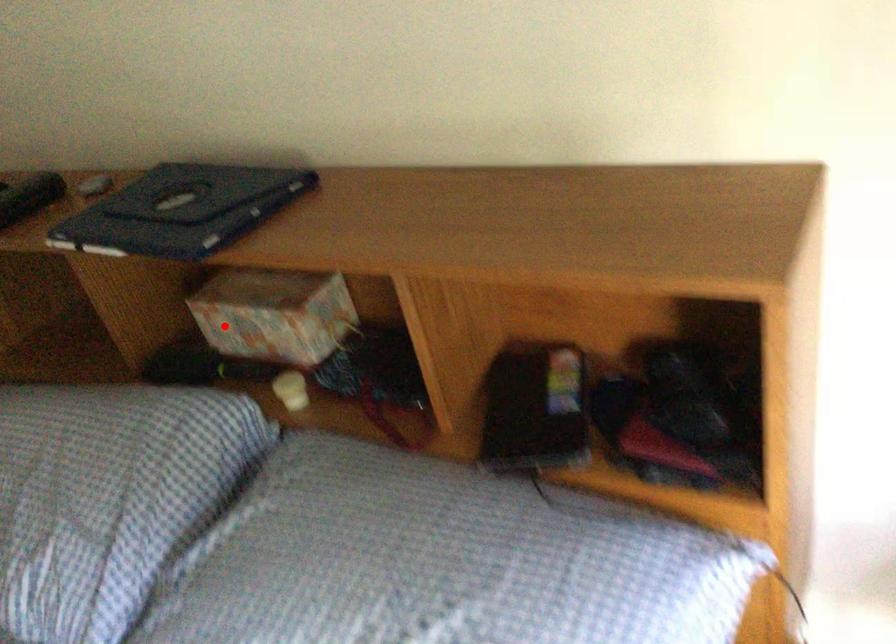
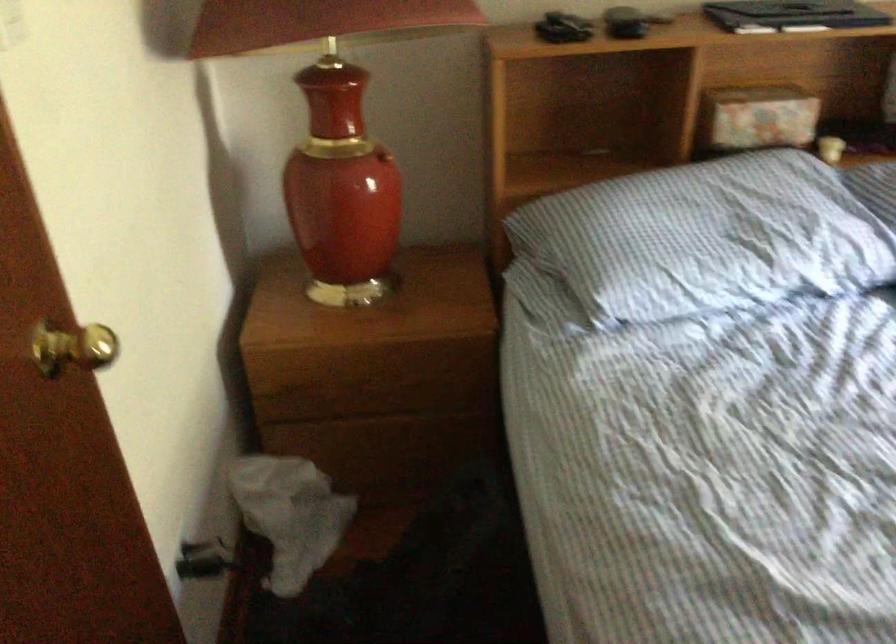
Locate, in the second image, the point that corresponds to the highlighted location in the first image.

(757, 118)